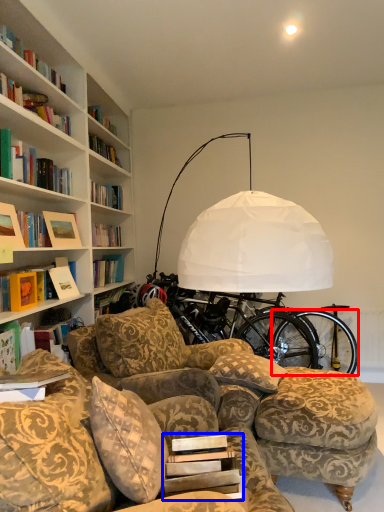
Question: Which object is closer to the camera taking this photo, bicycle wheel (highlighted by a red box) or paperback book (highlighted by a blue box)?

Choices:
 (A) bicycle wheel
 (B) paperback book

Answer: (B)